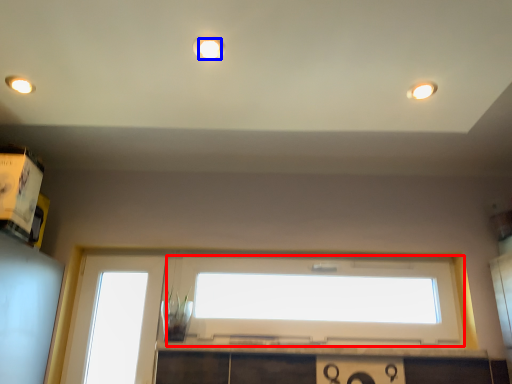
Question: Among these objects, which one is farthest to the camera, window (highlighted by a red box) or lighting (highlighted by a blue box)?

Choices:
 (A) window
 (B) lighting

Answer: (A)